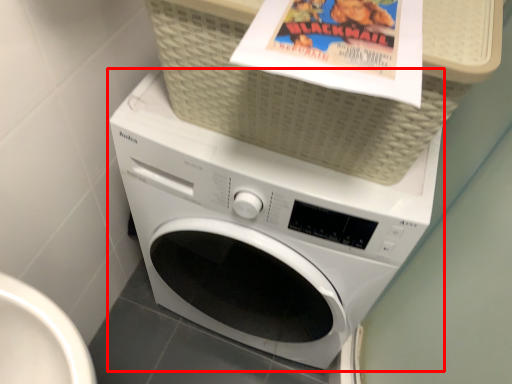
Question: Where is washing machine (annotated by the red box) located in relation to basket in the image?

Choices:
 (A) left
 (B) right

Answer: (A)